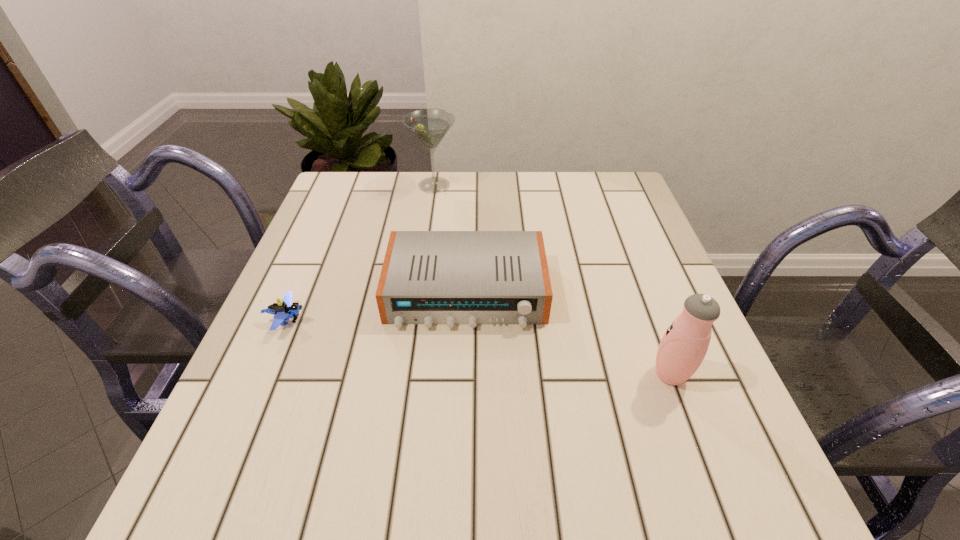
Image resolution: width=960 pixels, height=540 pixels. I want to click on the farthest object, so click(430, 125).

The height and width of the screenshot is (540, 960). Identify the location of the nearest object. pos(684,345).

Identify the location of the rightmost object. The image size is (960, 540). (684, 345).

Where is `the third tallest object`? the third tallest object is located at coordinates (428, 277).

You are a GUI agent. You are given a task and a screenshot of the screen. Output one action in this format:
    pyautogui.click(x=<x>, y=<y>)
    Task: Click on the shortest object
    
    Given the screenshot: What is the action you would take?
    pyautogui.click(x=284, y=310)

Where is `the leftmost object`? Image resolution: width=960 pixels, height=540 pixels. the leftmost object is located at coordinates (284, 310).

At what (x,y) coordinates should I click in order to perform the action: click on free space located 0.080m on the left of the martini. Please return your answer as a coordinate pair (x, y). The height and width of the screenshot is (540, 960). Looking at the image, I should click on click(x=383, y=185).

At what (x,y) coordinates should I click in order to perform the action: click on free space located on the left of the thermos bottle. Please return your answer as a coordinate pair (x, y). This screenshot has height=540, width=960. Looking at the image, I should click on (595, 374).

This screenshot has height=540, width=960. Identify the location of free space located on the control panel of the radio receiver. (464, 360).

Identify the location of vacant space located on the front-facing side of the leftmost object. The height and width of the screenshot is (540, 960). (391, 320).